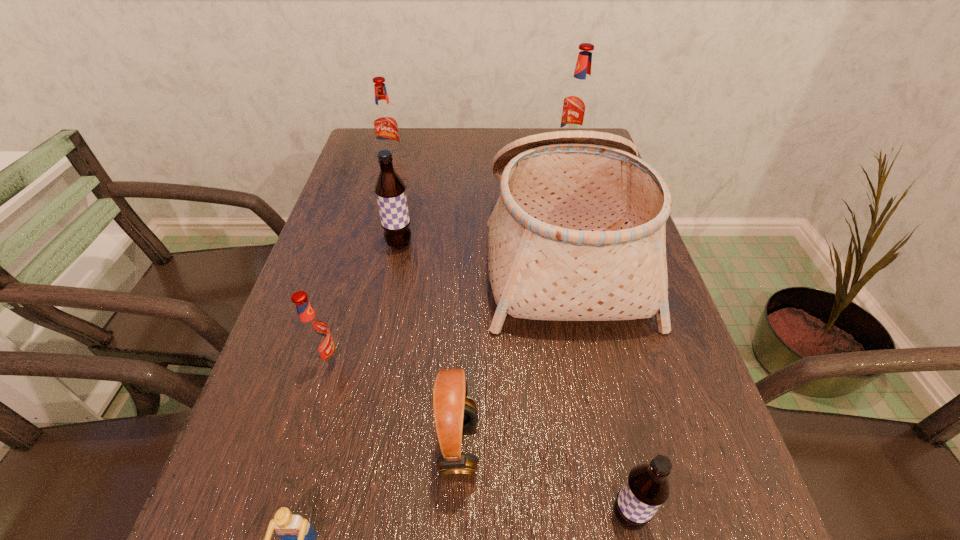
Find the location of a particular element. blank region between the basket and the nearest root beer is located at coordinates (595, 384).

I want to click on free space between the smallest red root beer and the rightmost root beer, so click(x=448, y=255).

Locate an element on the screen. vacant area that lies between the basket and the fifth object from left to right is located at coordinates (511, 349).

Where is `object that stands as the third closest to the shortest object`? This screenshot has height=540, width=960. object that stands as the third closest to the shortest object is located at coordinates (646, 488).

The height and width of the screenshot is (540, 960). What are the coordinates of `object that ranks as the sixth closest to the basket` in the screenshot? It's located at (646, 488).

At what (x,y) coordinates should I click in order to perform the action: click on the closest root beer to the fourth nearest object. Please return your answer as a coordinate pair (x, y). The height and width of the screenshot is (540, 960). Looking at the image, I should click on (390, 190).

Find the location of `the closest root beer to the bigger brown root beer`. the closest root beer to the bigger brown root beer is located at coordinates (313, 332).

Identify which red root beer is located as the nearest to the tallest root beer. Please provide its 2D coordinates. Your answer should be formatted as a tuple, i.e. [(x, y)], where the tuple contains the x and y coordinates of a point satisfying the conditions above.

[(385, 123)]

Locate an element on the screen. This screenshot has height=540, width=960. red root beer that can be found as the closest to the biggest red root beer is located at coordinates (385, 123).

Locate an element on the screen. The width and height of the screenshot is (960, 540). free point that satisfies the following two spatial constraints: 1. with the lid open on the basket; 2. on the right side of the fourth root beer from left to right is located at coordinates (616, 517).